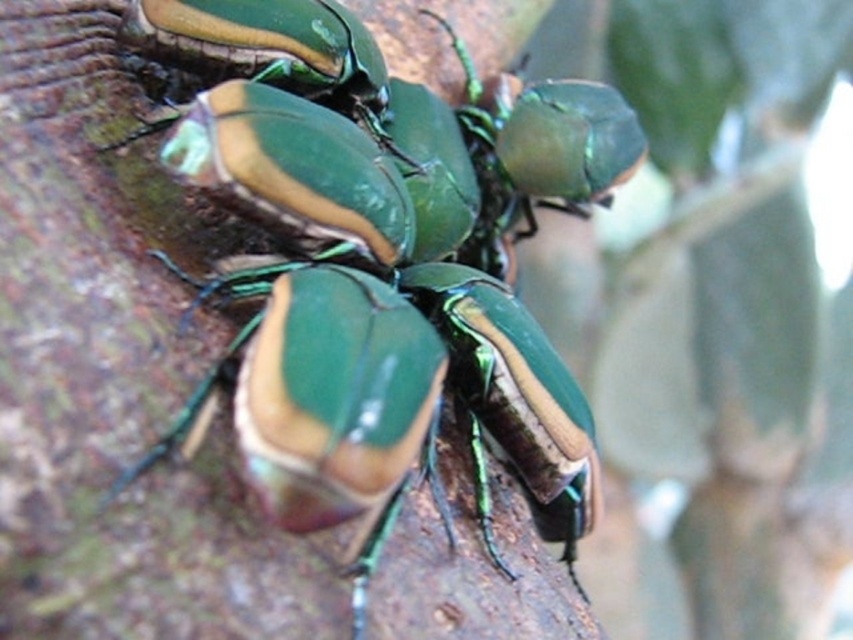
You are an entomologist observing two metallic green beetles in the image. The beetles are labeled as the metallic green beetle at center and the metallic green beetle at upper center. Based on their positions, which beetle do you think is closer to the observer?

The metallic green beetle at center is closer to the observer because it is larger in width than the metallic green beetle at upper center, indicating it is nearer due to perspective.

Based on the photo, you are an entomologist observing the beetles. You notice two beetles, the metallic green beetle at center and the metallic green beetle at upper center. Which beetle is closer to you?

The metallic green beetle at center is closer to you because it is in front of the metallic green beetle at upper center.